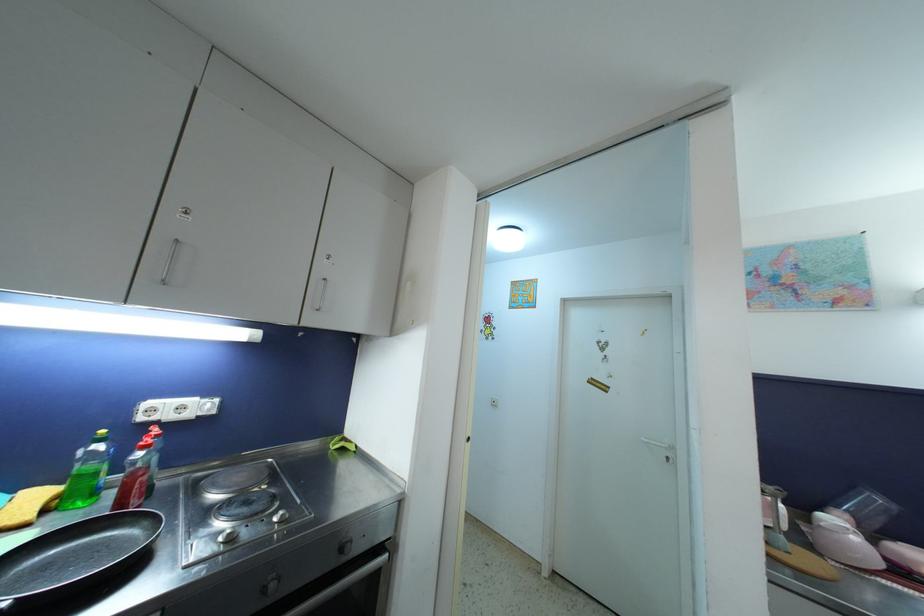
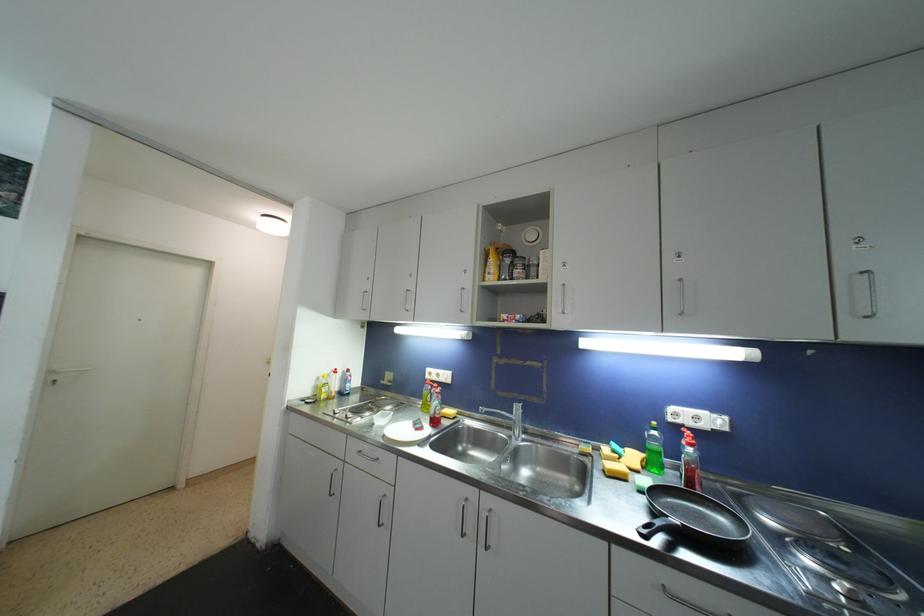
Question: Based on the continuous images, in which direction is the camera rotating? Reply with the corresponding letter.

Choices:
 (A) Left
 (B) Right
 (C) Up
 (D) Down

Answer: (A)